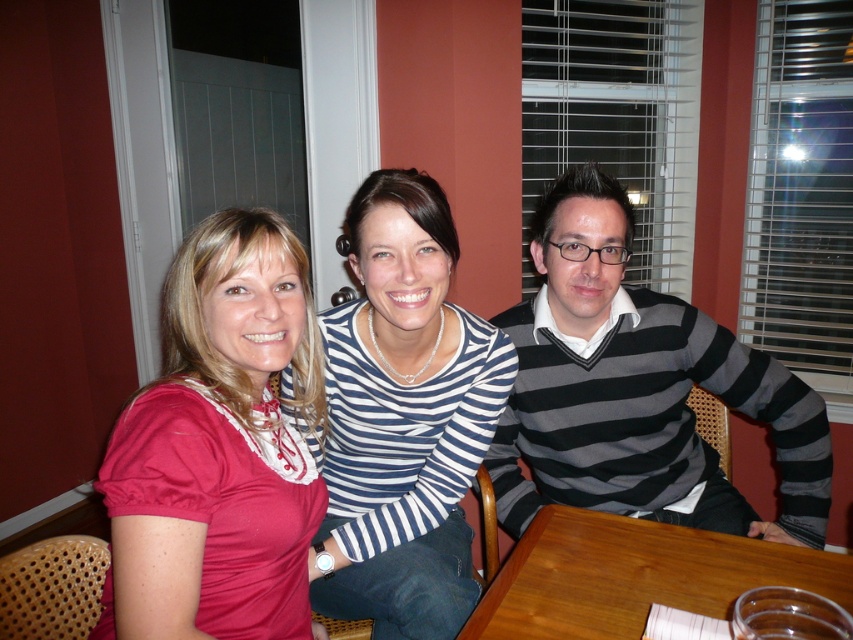
What do you see at coordinates (403, 419) in the screenshot? I see `striped knit sweater at center` at bounding box center [403, 419].

Is striped knit sweater at center wider than wooden table at center?

No.

Does point (445, 374) lie in front of point (641, 628)?

No, it is not.

Where is `striped knit sweater at center`? The width and height of the screenshot is (853, 640). striped knit sweater at center is located at coordinates (403, 419).

Can you confirm if satin red blouse at left is positioned to the right of striped knit sweater at center?

No, satin red blouse at left is not to the right of striped knit sweater at center.

What do you see at coordinates (219, 448) in the screenshot?
I see `satin red blouse at left` at bounding box center [219, 448].

Which is in front, point (125, 419) or point (428, 236)?

Point (125, 419) is in front.

This screenshot has height=640, width=853. What are the coordinates of `satin red blouse at left` in the screenshot? It's located at (219, 448).

Between striped sweater at center and wooden table at center, which one has more height?

Standing taller between the two is striped sweater at center.

Can you confirm if striped sweater at center is wider than wooden table at center?

Correct, the width of striped sweater at center exceeds that of wooden table at center.

Does point (734, 488) come behind point (831, 564)?

Yes.

Locate an element on the screen. This screenshot has width=853, height=640. striped sweater at center is located at coordinates point(637,388).